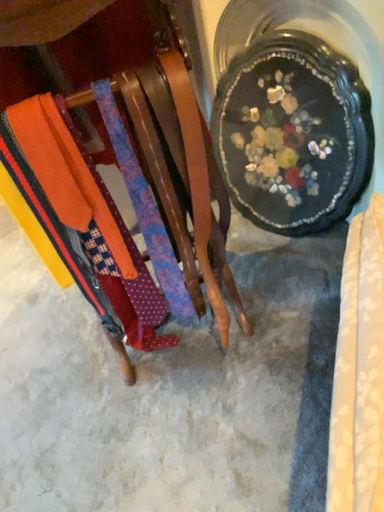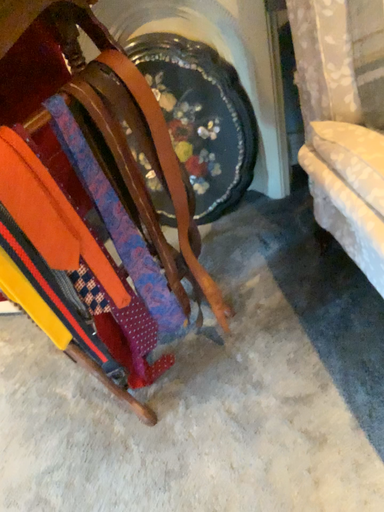
Question: How did the camera likely rotate when shooting the video?

Choices:
 (A) rotated left
 (B) rotated right

Answer: (B)